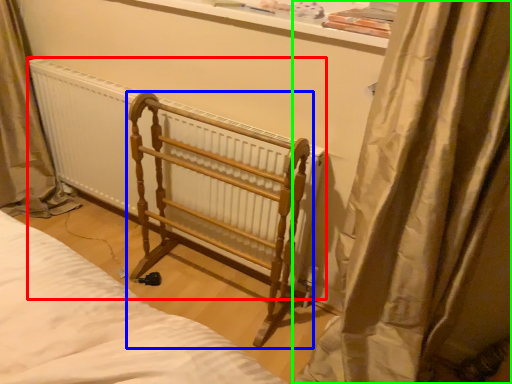
Question: Which object is positioned closest to radiator (highlighted by a red box)? Select from furniture (highlighted by a blue box) and curtain (highlighted by a green box).

Choices:
 (A) furniture
 (B) curtain

Answer: (A)